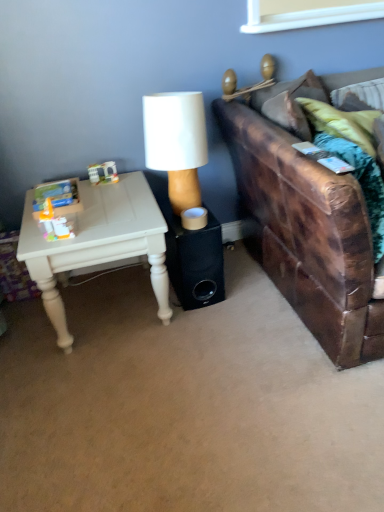
At what (x,y) coordinates should I click in order to perform the action: click on empty space that is to the right of black matte speaker at center. Please return your answer as a coordinate pair (x, y). Image resolution: width=384 pixels, height=512 pixels. Looking at the image, I should click on (247, 289).